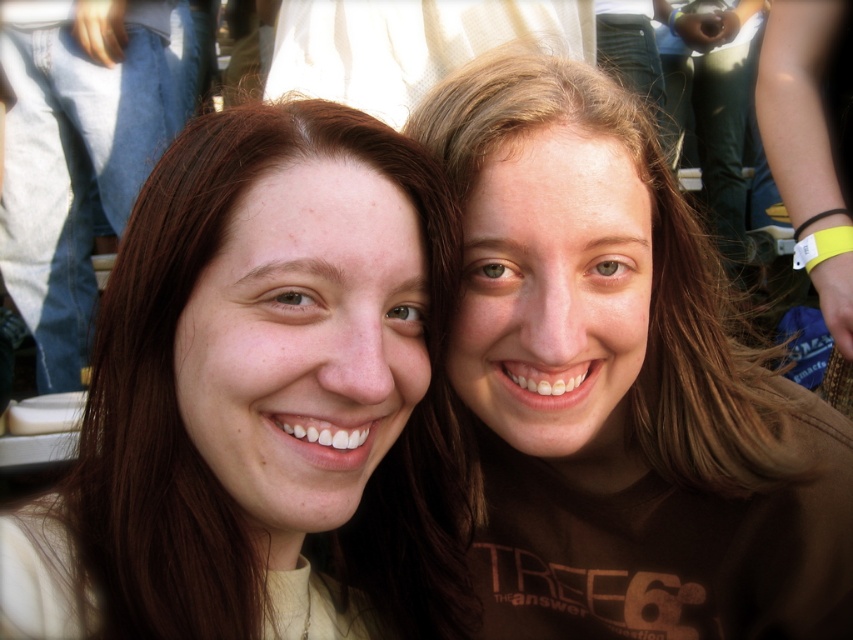
Question: Is matte beige hair at left above matte brown hair at left?

Choices:
 (A) yes
 (B) no

Answer: (B)

Question: Which point is farther from the camera taking this photo?

Choices:
 (A) (97, 161)
 (B) (526, 516)
 (C) (201, 244)

Answer: (A)

Question: Can you confirm if matte beige hair at left is positioned below matte brown hair at left?

Choices:
 (A) no
 (B) yes

Answer: (B)

Question: Does brown matte hair at upper right appear over matte brown hair at left?

Choices:
 (A) yes
 (B) no

Answer: (B)

Question: Which of the following is the closest to the observer?

Choices:
 (A) matte beige hair at left
 (B) brown matte hair at upper right
 (C) matte brown hair at left

Answer: (A)

Question: Which point is closer to the camera?

Choices:
 (A) matte beige hair at left
 (B) brown matte hair at upper right

Answer: (A)